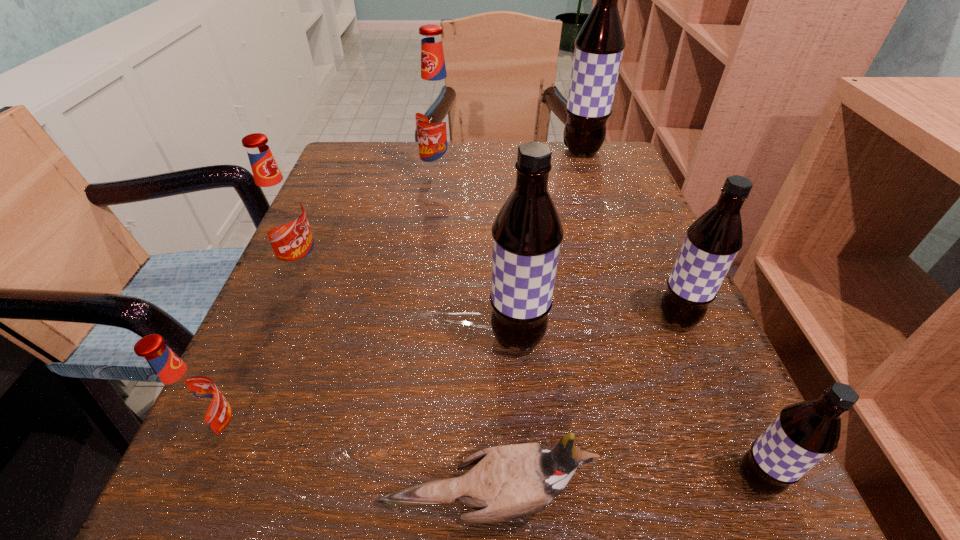
At what (x,y) coordinates should I click in order to perform the action: click on empty location between the biggest brown root beer and the sixth nearest root beer. Please return your answer as a coordinate pair (x, y). The height and width of the screenshot is (540, 960). Looking at the image, I should click on (512, 165).

The image size is (960, 540). What are the coordinates of `vacant space in between the third farthest root beer and the third nearest object` in the screenshot? It's located at (262, 352).

Find the location of a particular element. The width and height of the screenshot is (960, 540). free space that is in between the third biggest brown root beer and the nearest red root beer is located at coordinates pos(449,376).

Where is `object that is the closest to the tallest object`? object that is the closest to the tallest object is located at coordinates (436, 114).

Locate an element on the screen. This screenshot has height=540, width=960. object that is the seventh closest to the fifth root beer from right to left is located at coordinates (804, 433).

Find the location of `root beer that is the fourth closest one to the bird`. root beer that is the fourth closest one to the bird is located at coordinates (713, 240).

Select which root beer is the fifth closest to the nearest root beer. Please provide its 2D coordinates. Your answer should be formatted as a tuple, i.e. [(x, y)], where the tuple contains the x and y coordinates of a point satisfying the conditions above.

[(436, 114)]

Locate an element on the screen. the third closest brown root beer to the nearest brown root beer is located at coordinates (599, 46).

Image resolution: width=960 pixels, height=540 pixels. Find the location of `brown root beer that is the closest to the third smallest brown root beer`. brown root beer that is the closest to the third smallest brown root beer is located at coordinates (713, 240).

Where is `red root beer that is the closest to the sixth farthest root beer`? red root beer that is the closest to the sixth farthest root beer is located at coordinates (282, 216).